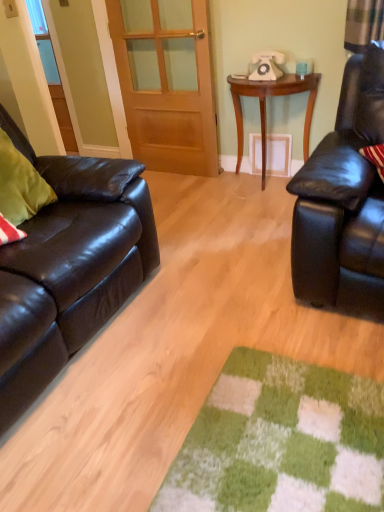
What do you see at coordinates (175, 349) in the screenshot? I see `matte black leather couch at left` at bounding box center [175, 349].

In order to click on white plastic telephone at upper center in this screenshot , I will do `click(267, 66)`.

You are a GUI agent. You are given a task and a screenshot of the screen. Output one action in this format:
    pyautogui.click(x=<x>, y=<y>)
    Task: Click on the shiny black leather couch at left
    The image size is (384, 512).
    Given the screenshot: What is the action you would take?
    pyautogui.click(x=70, y=266)

What do you see at coordinates (70, 266) in the screenshot? I see `shiny black leather couch at left` at bounding box center [70, 266].

Identify the location of matte black leather couch at left. (175, 349).

How far apart are shiny black leather couch at left and wooden door at center?

A distance of 1.47 meters exists between shiny black leather couch at left and wooden door at center.

Considering the relative positions of shiny black leather couch at left and wooden door at center in the image provided, is shiny black leather couch at left behind wooden door at center?

No.

Considering the relative sizes of shiny black leather couch at left and wooden door at center in the image provided, is shiny black leather couch at left taller than wooden door at center?

Incorrect, the height of shiny black leather couch at left is not larger of that of wooden door at center.

Considering the positions of point (26, 338) and point (135, 125), is point (26, 338) closer or farther from the camera than point (135, 125)?

Point (26, 338) is positioned closer to the camera compared to point (135, 125).

Looking at their sizes, would you say white plastic telephone at upper center is wider or thinner than matte black leather couch at left?

white plastic telephone at upper center is thinner than matte black leather couch at left.

Is the surface of white plastic telephone at upper center in direct contact with matte black leather couch at left?

They are not placed beside each other.

Which object is positioned more to the left, white plastic telephone at upper center or matte black leather couch at left?

Positioned to the left is matte black leather couch at left.

From a real-world perspective, who is located higher, white plastic telephone at upper center or matte black leather couch at left?

In real-world perspective, white plastic telephone at upper center is above.

Is matte black leather couch at left shorter than wooden door at center?

Indeed, matte black leather couch at left has a lesser height compared to wooden door at center.

Locate an element on the screen. The image size is (384, 512). door positioned vertically above the matte black leather couch at left (from a real-world perspective) is located at coordinates (166, 84).

Is matte black leather couch at left with wooden door at center?

They are not placed beside each other.

Can you tell me how much matte black leather couch at left and wooden door at center differ in facing direction?

The angular difference between matte black leather couch at left and wooden door at center is 88.8 degrees.

From the image's perspective, does wooden door at center appear lower than wooden table at center?

No, from the image's perspective, wooden door at center is not below wooden table at center.

Considering the sizes of objects wooden door at center and wooden table at center in the image provided, who is smaller, wooden door at center or wooden table at center?

wooden door at center is smaller.

From a real-world perspective, is wooden door at center above or below wooden table at center?

From a real-world perspective, wooden door at center is physically above wooden table at center.

Are white plastic telephone at upper center and wooden door at center located far from each other?

No, white plastic telephone at upper center is not far away from wooden door at center.

From the image's perspective, is white plastic telephone at upper center under wooden door at center?

No, from the image's perspective, white plastic telephone at upper center is not beneath wooden door at center.

Which of these two, white plastic telephone at upper center or wooden door at center, is wider?

white plastic telephone at upper center is wider.

Does point (262, 55) come farther from viewer compared to point (144, 42)?

No, it is not.

Does point (95, 311) lie behind point (273, 59)?

No.

Is shiny black leather couch at left located outside white plastic telephone at upper center?

Yes, shiny black leather couch at left is not within white plastic telephone at upper center.

Does shiny black leather couch at left have a greater height compared to white plastic telephone at upper center?

Answer: Yes, shiny black leather couch at left is taller than white plastic telephone at upper center.

Consider the image. Does wooden door at center have a greater height compared to shiny black leather couch at left?

Correct, wooden door at center is much taller as shiny black leather couch at left.

From the image's perspective, is wooden door at center beneath shiny black leather couch at left?

No, from the image's perspective, wooden door at center is not beneath shiny black leather couch at left.

Is wooden door at center aimed at shiny black leather couch at left?

Yes, wooden door at center is facing shiny black leather couch at left.

Which is farther from the camera, (134, 152) or (148, 192)?

The point (134, 152) is more distant.

In order to click on studio couch located in front of the wooden door at center in this screenshot , I will do `click(70, 266)`.

Find the location of `plain below the white plastic telephone at upper center (from a real-world perspective)`. plain below the white plastic telephone at upper center (from a real-world perspective) is located at coordinates (175, 349).

Based on their spatial positions, is white plastic telephone at upper center or matte black leather couch at left further from wooden table at center?

matte black leather couch at left.

Looking at the image, which one is located further to wooden table at center, wooden door at center or matte black leather couch at left?

matte black leather couch at left lies further to wooden table at center than the other object.

In the scene shown: Considering their positions, is wooden table at center positioned further to wooden door at center than shiny black leather couch at left?

Based on the image, shiny black leather couch at left appears to be further to wooden door at center.

Looking at the image, which one is located further to wooden door at center, wooden table at center or white plastic telephone at upper center?

white plastic telephone at upper center lies further to wooden door at center than the other object.

Based on their spatial positions, is wooden door at center or wooden table at center closer to matte black leather couch at left?

Based on the image, wooden table at center appears to be nearer to matte black leather couch at left.

Considering their positions, is matte black leather couch at left positioned closer to shiny black leather couch at left than wooden table at center?

The object closer to shiny black leather couch at left is matte black leather couch at left.

Looking at the image, which one is located further to white plastic telephone at upper center, matte black leather couch at left or wooden door at center?

matte black leather couch at left is further to white plastic telephone at upper center.

Which object lies nearer to the anchor point matte black leather couch at left, shiny black leather couch at left or wooden door at center?

shiny black leather couch at left.

Locate an element on the screen. The image size is (384, 512). table between matte black leather couch at left and white plastic telephone at upper center in the front-back direction is located at coordinates (265, 106).

Identify the location of plain located between shiny black leather couch at left and white plastic telephone at upper center in the depth direction. (175, 349).

I want to click on plain between shiny black leather couch at left and wooden table at center in the front-back direction, so click(x=175, y=349).

Find the location of a particular element. This screenshot has height=512, width=384. corded phone located between wooden door at center and wooden table at center in the left-right direction is located at coordinates pyautogui.click(x=267, y=66).